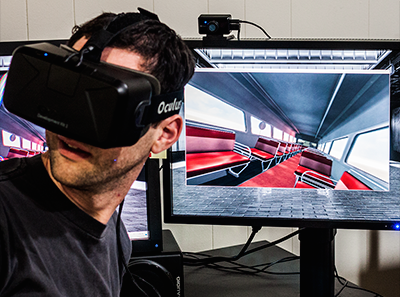
Find the location of `webcam`. webcam is located at coordinates (215, 21).